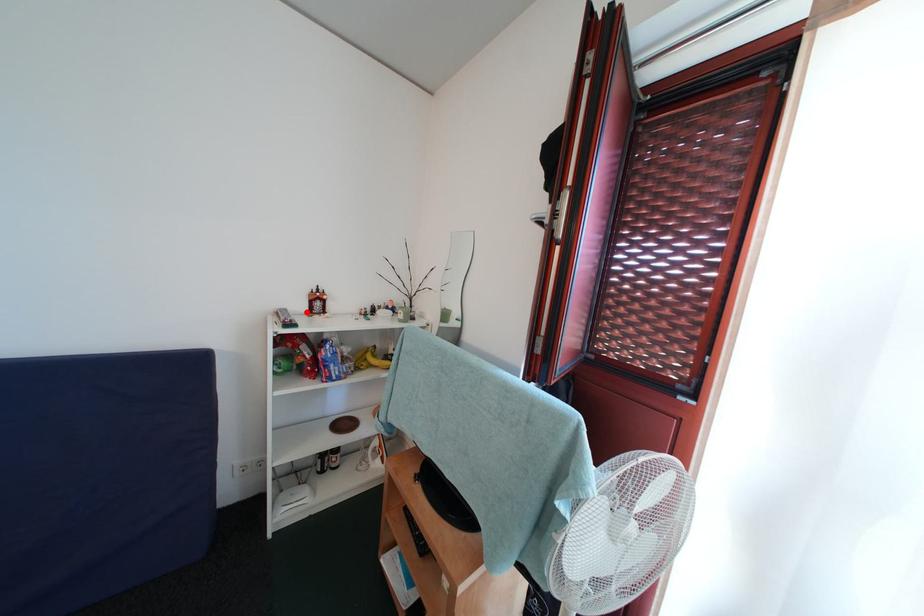
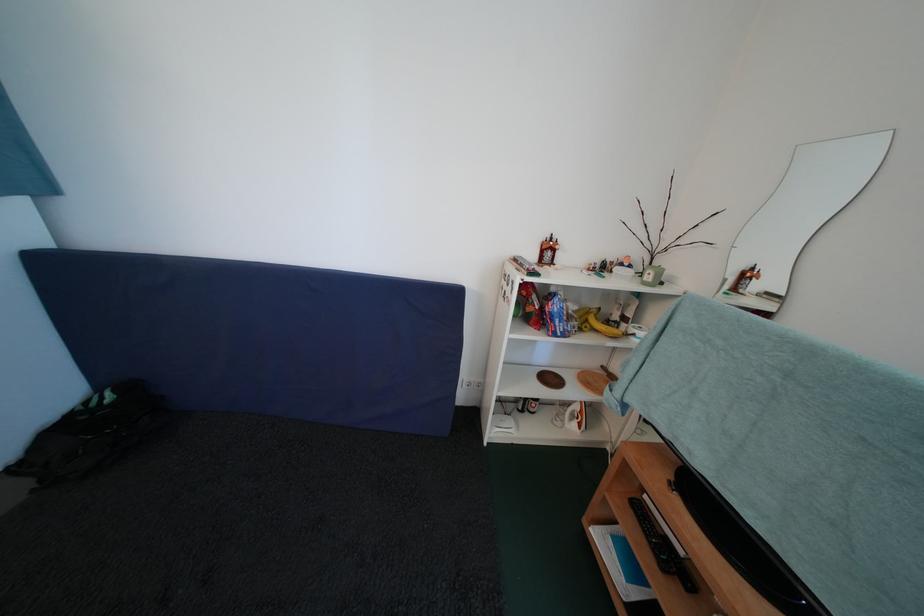
Find the pixel in the second image that matches the highlighted location in the first image.

(539, 261)